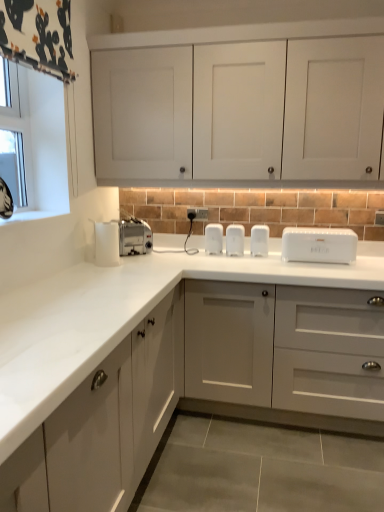
Locate an element on the screen. vacant region in front of white plastic toaster at center, which is counted as the 2th appliance, starting from the right is located at coordinates (236, 257).